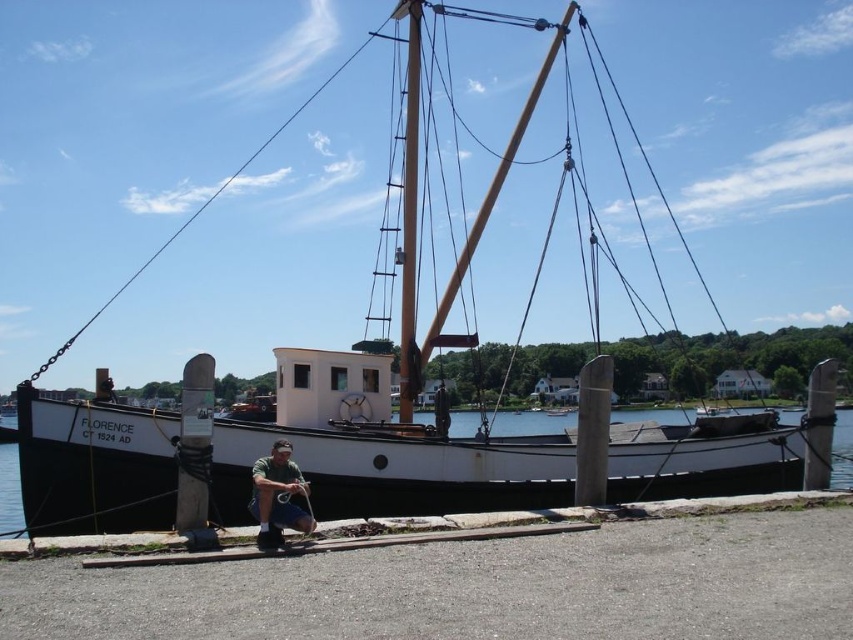
Based on the scene, can you determine which object, the wooden mast at center or the white matte water at center, occupies a larger area in the image?

The white matte water at center occupies a larger area in the image because the wooden mast at center is smaller than the white matte water at center according to the description.

You are standing on the pier next to the man in green and blue. You want to throw a lifebuoy to someone in the water at the white matte water at center. Considering the distance, is it feasible for you to reach them with a standard throw?

The white matte water at center is 13.89 meters away from the viewer. A standard throw typically has a range of around 10 to 15 meters, so it might be possible but would require a strong and accurate throw.